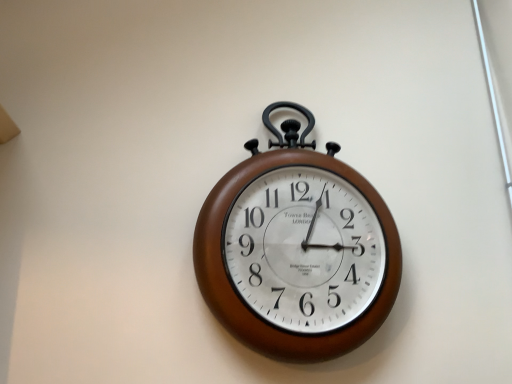
This screenshot has height=384, width=512. What do you see at coordinates (297, 249) in the screenshot?
I see `brown wooden clock at center` at bounding box center [297, 249].

Locate an element on the screen. This screenshot has width=512, height=384. brown wooden clock at center is located at coordinates (297, 249).

Measure the distance between brown wooden clock at center and camera.

The depth of brown wooden clock at center is 36.11 inches.

Locate an element on the screen. This screenshot has width=512, height=384. brown wooden clock at center is located at coordinates (297, 249).